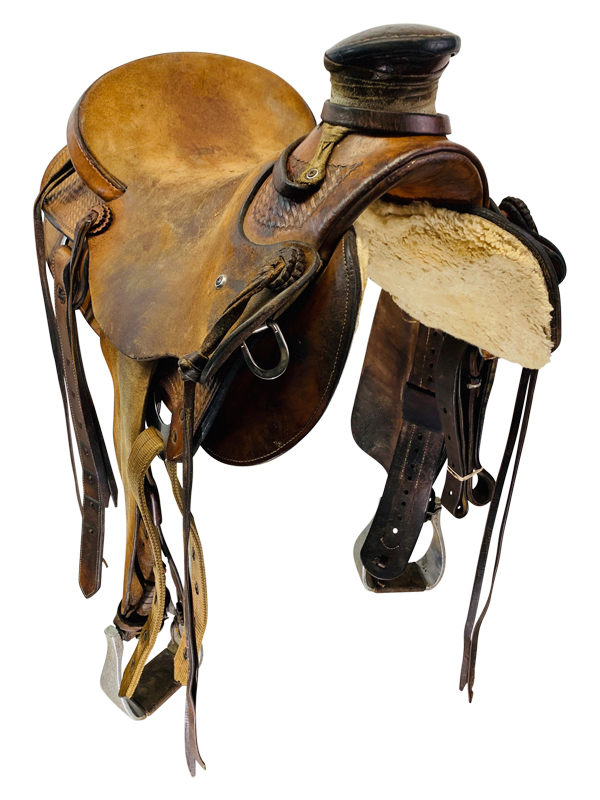
Where is `trim around seat`? Image resolution: width=600 pixels, height=800 pixels. trim around seat is located at coordinates (101, 184).